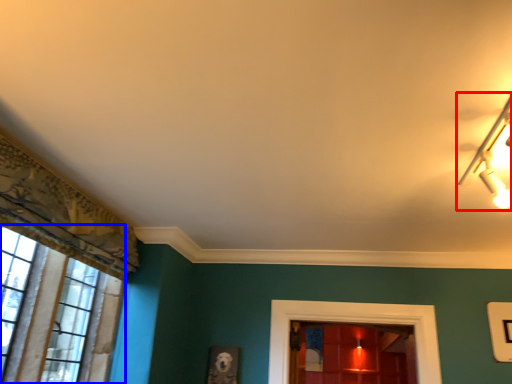
Question: Which object is closer to the camera taking this photo, lamp (highlighted by a red box) or window (highlighted by a blue box)?

Choices:
 (A) lamp
 (B) window

Answer: (A)